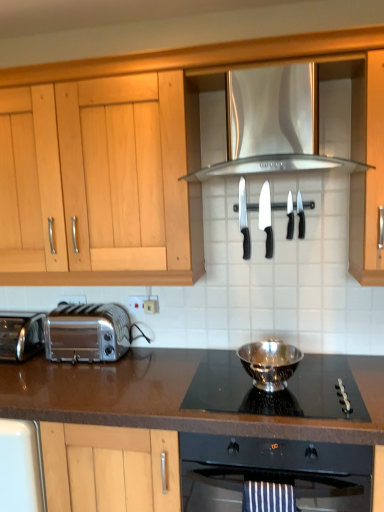
Question: Can you confirm if polished stainless steel bowl at center is taller than brown laminate countertop at center?

Choices:
 (A) no
 (B) yes

Answer: (A)

Question: Does polished stainless steel bowl at center have a greater width compared to brown laminate countertop at center?

Choices:
 (A) yes
 (B) no

Answer: (B)

Question: Is polished stainless steel bowl at center not within brown laminate countertop at center?

Choices:
 (A) no
 (B) yes

Answer: (B)

Question: Is polished stainless steel bowl at center further to the viewer compared to brown laminate countertop at center?

Choices:
 (A) no
 (B) yes

Answer: (B)

Question: Is polished stainless steel bowl at center touching brown laminate countertop at center?

Choices:
 (A) no
 (B) yes

Answer: (A)

Question: Is polished stainless steel bowl at center turned away from brown laminate countertop at center?

Choices:
 (A) yes
 (B) no

Answer: (B)

Question: Considering the relative sizes of polished stainless steel bowl at center and white plastic electric outlet at lower center, the 2th electric outlet viewed from the back, in the image provided, is polished stainless steel bowl at center taller than white plastic electric outlet at lower center, the 2th electric outlet viewed from the back,?

Choices:
 (A) yes
 (B) no

Answer: (A)

Question: Can you confirm if polished stainless steel bowl at center is smaller than white plastic electric outlet at lower center, arranged as the second electric outlet when viewed from the left?

Choices:
 (A) no
 (B) yes

Answer: (A)

Question: Can you confirm if polished stainless steel bowl at center is bigger than white plastic electric outlet at lower center, which appears as the 1th electric outlet when viewed from the front?

Choices:
 (A) no
 (B) yes

Answer: (B)

Question: Is the depth of polished stainless steel bowl at center greater than that of white plastic electric outlet at lower center, arranged as the second electric outlet when viewed from the left?

Choices:
 (A) yes
 (B) no

Answer: (B)

Question: Is polished stainless steel bowl at center thinner than white plastic electric outlet at lower center, the 2th electric outlet viewed from the back?

Choices:
 (A) yes
 (B) no

Answer: (B)

Question: Considering the relative positions of polished stainless steel bowl at center and white plastic electric outlet at lower center, the 2th electric outlet viewed from the back, in the image provided, is polished stainless steel bowl at center to the left of white plastic electric outlet at lower center, the 2th electric outlet viewed from the back, from the viewer's perspective?

Choices:
 (A) yes
 (B) no

Answer: (B)

Question: Is white plastic electric outlet at lower center, arranged as the second electric outlet when viewed from the left, not inside black plastic knife at center, the second knife viewed from the left?

Choices:
 (A) yes
 (B) no

Answer: (A)